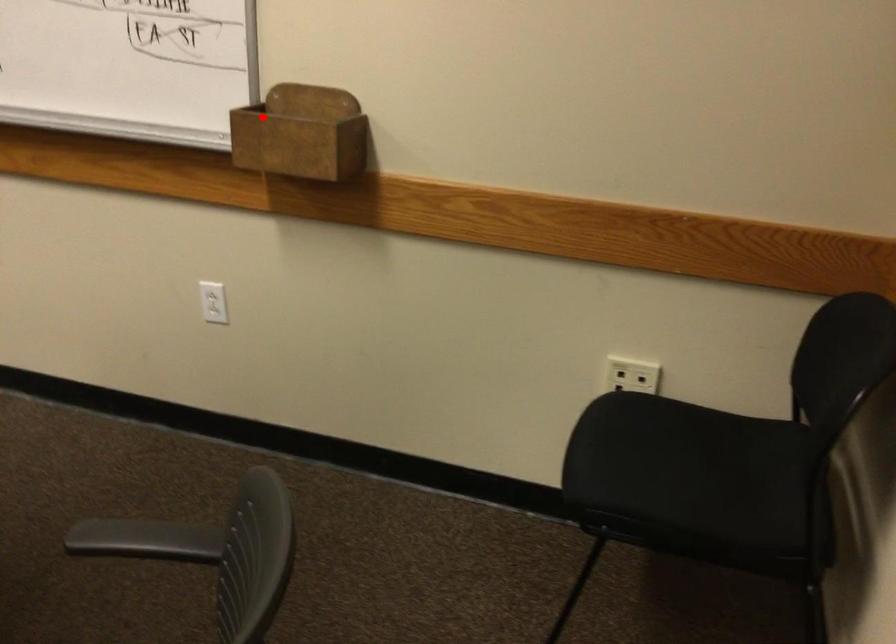
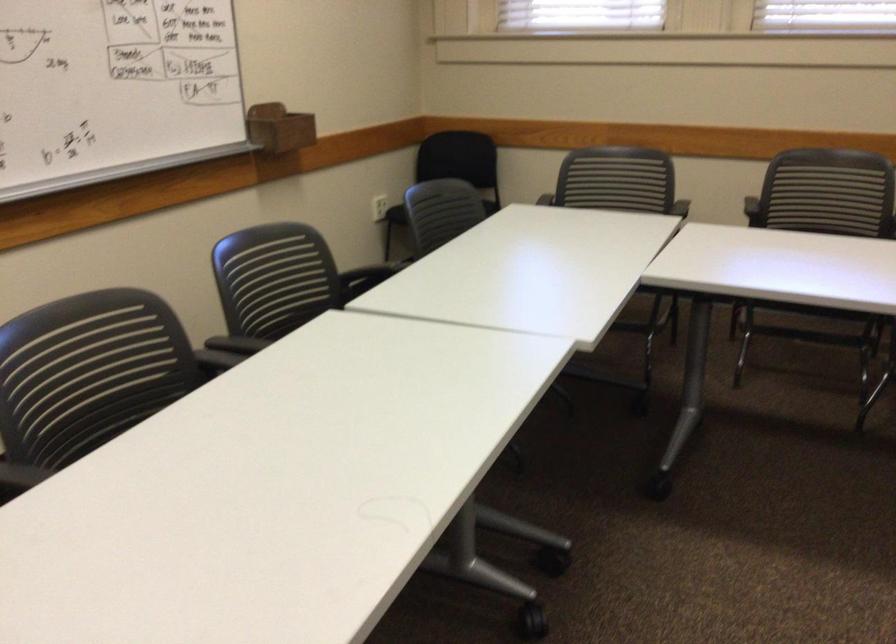
Question: A red point is marked in image1. In image2, is the corresponding 3D point closer to the camera or farther? Reply with the corresponding letter.

Choices:
 (A) The corresponding 3D point is closer.
 (B) The corresponding 3D point is farther.

Answer: (B)